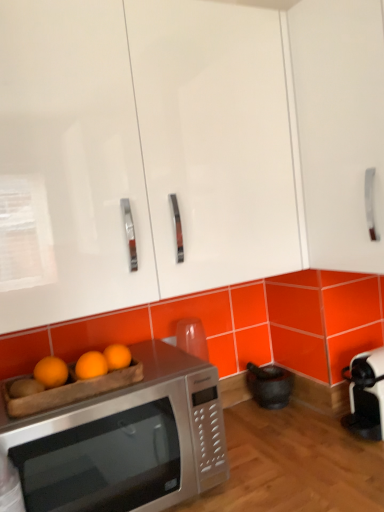
Question: From the image's perspective, is orange matte wood tray at lower left located above satin silver microwave at lower left?

Choices:
 (A) no
 (B) yes

Answer: (B)

Question: Does orange matte wood tray at lower left appear on the right side of satin silver microwave at lower left?

Choices:
 (A) yes
 (B) no

Answer: (B)

Question: Is orange matte wood tray at lower left oriented towards satin silver microwave at lower left?

Choices:
 (A) no
 (B) yes

Answer: (A)

Question: Can you confirm if orange matte wood tray at lower left is wider than satin silver microwave at lower left?

Choices:
 (A) yes
 (B) no

Answer: (B)

Question: Is satin silver microwave at lower left at the back of orange matte wood tray at lower left?

Choices:
 (A) no
 (B) yes

Answer: (A)

Question: Is point (72, 182) closer or farther from the camera than point (23, 380)?

Choices:
 (A) closer
 (B) farther

Answer: (B)

Question: From a real-world perspective, relative to orange matte wood tray at lower left, is white glossy cabinet at upper center, which is the 2th cabinetry from right to left, vertically above or below?

Choices:
 (A) above
 (B) below

Answer: (A)

Question: Considering the relative positions of white glossy cabinet at upper center, which is the 2th cabinetry from right to left, and orange matte wood tray at lower left in the image provided, is white glossy cabinet at upper center, which is the 2th cabinetry from right to left, to the left or to the right of orange matte wood tray at lower left?

Choices:
 (A) left
 (B) right

Answer: (B)

Question: Considering their positions, is white glossy cabinet at upper center, which is the 2th cabinetry from right to left, located in front of or behind orange matte wood tray at lower left?

Choices:
 (A) behind
 (B) front

Answer: (B)

Question: Considering the positions of white glossy cabinet at upper center, which is the 2th cabinetry from right to left, and white glossy cabinet at upper right, placed as the 1th cabinetry when sorted from right to left, in the image, is white glossy cabinet at upper center, which is the 2th cabinetry from right to left, taller or shorter than white glossy cabinet at upper right, placed as the 1th cabinetry when sorted from right to left,?

Choices:
 (A) tall
 (B) short

Answer: (B)

Question: From a real-world perspective, is white glossy cabinet at upper center, which is the 2th cabinetry from right to left, positioned above or below white glossy cabinet at upper right, which appears as the second cabinetry when viewed from the left?

Choices:
 (A) below
 (B) above

Answer: (B)

Question: In the image, is white glossy cabinet at upper center, which is the 2th cabinetry from right to left, positioned in front of or behind white glossy cabinet at upper right, which appears as the second cabinetry when viewed from the left?

Choices:
 (A) front
 (B) behind

Answer: (A)

Question: In terms of size, does white glossy cabinet at upper center, which is counted as the 1th cabinetry, starting from the left, appear bigger or smaller than white glossy cabinet at upper right, which appears as the second cabinetry when viewed from the left?

Choices:
 (A) small
 (B) big

Answer: (B)

Question: Is satin silver microwave at lower left in front of or behind orange matte wood tray at lower left in the image?

Choices:
 (A) behind
 (B) front

Answer: (B)

Question: Is satin silver microwave at lower left inside or outside of orange matte wood tray at lower left?

Choices:
 (A) inside
 (B) outside

Answer: (B)